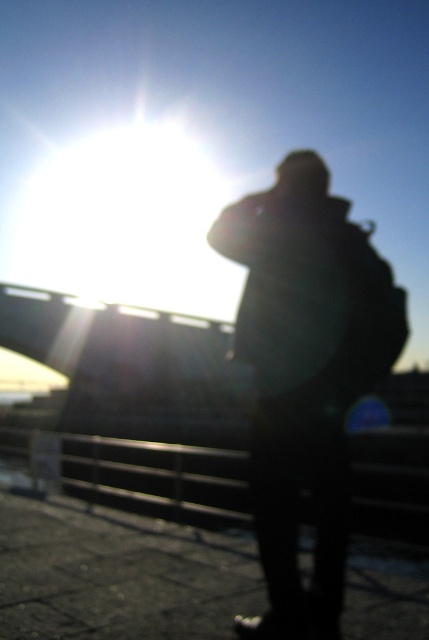
Does black matte jacket at center appear over metallic bridge at center?

Yes, black matte jacket at center is above metallic bridge at center.

Is black matte jacket at center shorter than metallic bridge at center?

Correct, black matte jacket at center is not as tall as metallic bridge at center.

Is point (277, 410) positioned in front of point (184, 376)?

Yes, it is in front of point (184, 376).

Locate an element on the screen. Image resolution: width=429 pixels, height=640 pixels. black matte jacket at center is located at coordinates (305, 376).

Which is more to the right, metallic bridge at center or metallic silver rail at lower center?

From the viewer's perspective, metallic bridge at center appears more on the right side.

I want to click on metallic bridge at center, so click(138, 397).

At what (x,y) coordinates should I click in order to perform the action: click on metallic bridge at center. Please return your answer as a coordinate pair (x, y). The width and height of the screenshot is (429, 640). Looking at the image, I should click on (138, 397).

Where is `metallic bridge at center`? metallic bridge at center is located at coordinates (138, 397).

Does black matte jacket at center appear under metallic silver rail at lower center?

Actually, black matte jacket at center is above metallic silver rail at lower center.

Is point (319, 449) farther from camera compared to point (220, 472)?

No, it is in front of (220, 472).

Identify the location of black matte jacket at center. (305, 376).